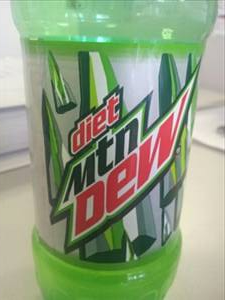
Identify the location of table. The image size is (225, 300). [x=207, y=196].